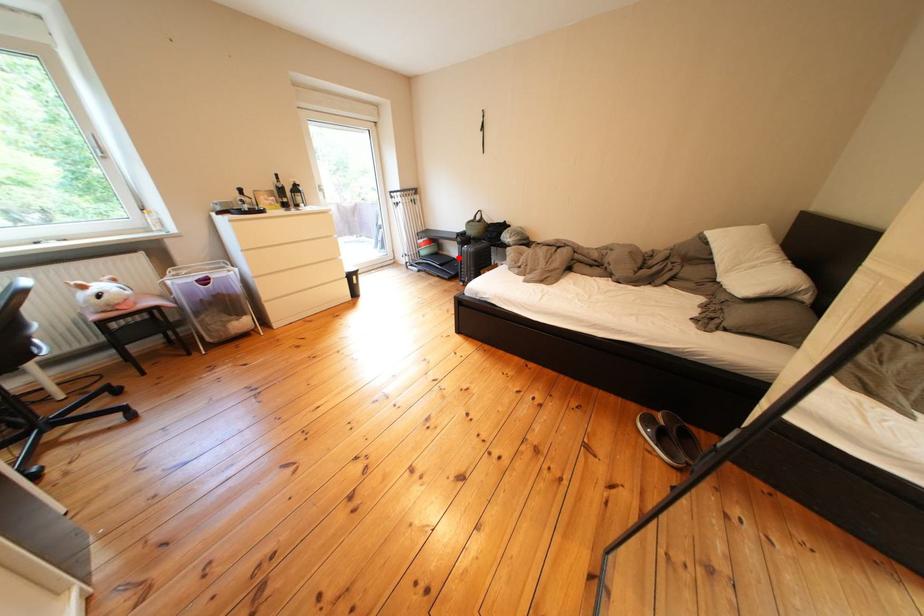
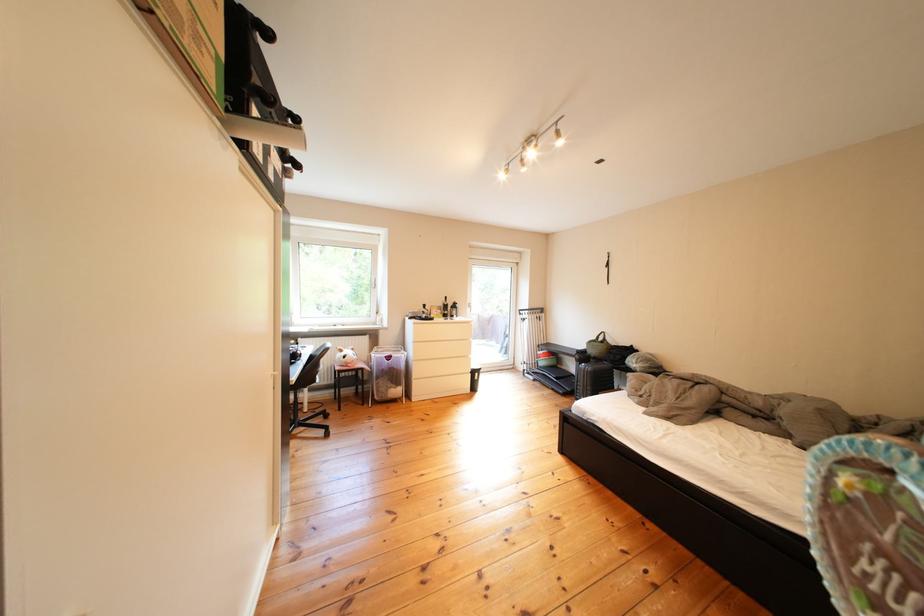
Find the pixel in the second image that matches the highlighted location in the first image.

(578, 371)